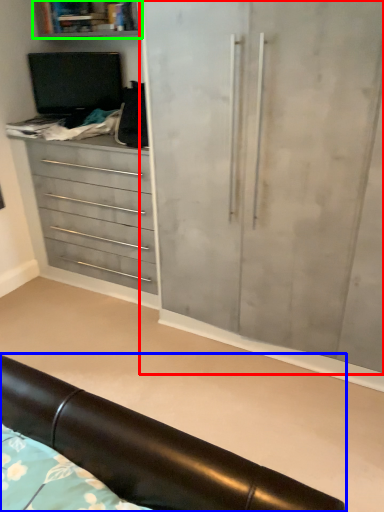
Question: Which object is positioned closest to cupboard (highlighted by a red box)? Select from furniture (highlighted by a blue box) and shelf (highlighted by a green box).

Choices:
 (A) furniture
 (B) shelf

Answer: (A)